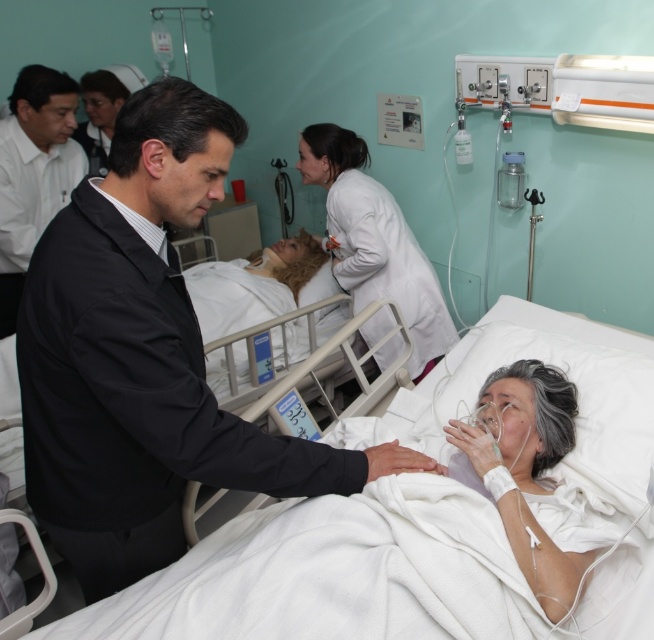
Question: Which of the following is the closest to the observer?

Choices:
 (A) white smooth lab coat at center
 (B) smooth white coat at upper center
 (C) smooth white pillow at center
 (D) white matte coat at center

Answer: (D)

Question: Does white fabric bed at center come in front of white smooth lab coat at center?

Choices:
 (A) no
 (B) yes

Answer: (B)

Question: Which of the following is the farthest from the observer?

Choices:
 (A) white fabric bed at center
 (B) smooth white pillow at center
 (C) smooth white coat at upper center
 (D) white smooth lab coat at center

Answer: (C)

Question: In this image, where is white fabric bed at center located relative to smooth white coat at upper center?

Choices:
 (A) above
 (B) below

Answer: (B)

Question: Among these points, which one is farthest from the camera?

Choices:
 (A) click(101, 336)
 (B) click(97, 76)
 (C) click(264, 525)
 (D) click(22, 150)

Answer: (B)

Question: Is white smooth lab coat at center further to camera compared to smooth white coat at upper center?

Choices:
 (A) no
 (B) yes

Answer: (A)